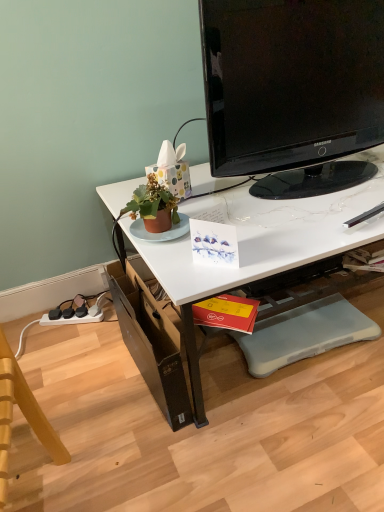
Question: From a real-world perspective, is black glossy television at upper center positioned above or below gray rubber footrest at lower center?

Choices:
 (A) above
 (B) below

Answer: (A)

Question: Is point (221, 162) positioned closer to the camera than point (312, 320)?

Choices:
 (A) closer
 (B) farther

Answer: (A)

Question: Which is nearer to the black glossy television at upper center?

Choices:
 (A) red matte book at lower center
 (B) gray rubber footrest at lower center
 (C) brown cardboard drawer at lower left
 (D) white glossy desk at upper center
 (E) wooden swivel chair at lower left

Answer: (D)

Question: Based on their relative distances, which object is farther from the wooden swivel chair at lower left?

Choices:
 (A) white glossy desk at upper center
 (B) brown cardboard drawer at lower left
 (C) red matte book at lower center
 (D) gray rubber footrest at lower center
 (E) black glossy television at upper center

Answer: (E)